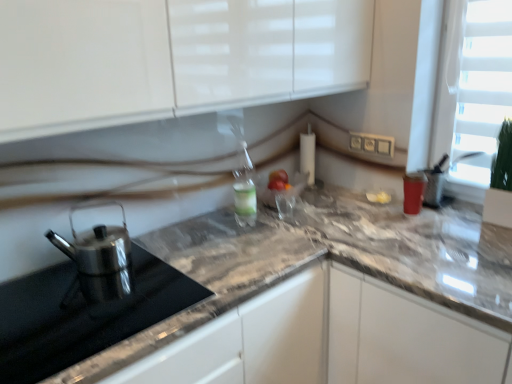
Question: From a real-world perspective, is polished stainless steel kettle at left physically below marble countertop at right?

Choices:
 (A) no
 (B) yes

Answer: (A)

Question: Is the depth of polished stainless steel kettle at left greater than that of marble countertop at right?

Choices:
 (A) no
 (B) yes

Answer: (A)

Question: Is marble countertop at right completely or partially inside polished stainless steel kettle at left?

Choices:
 (A) yes
 (B) no

Answer: (B)

Question: Can you confirm if polished stainless steel kettle at left is wider than marble countertop at right?

Choices:
 (A) yes
 (B) no

Answer: (B)

Question: Is polished stainless steel kettle at left completely or partially outside of marble countertop at right?

Choices:
 (A) yes
 (B) no

Answer: (A)

Question: Does polished stainless steel kettle at left have a greater height compared to marble countertop at right?

Choices:
 (A) no
 (B) yes

Answer: (A)

Question: Is marble countertop at right taller than polished stainless steel kettle at left?

Choices:
 (A) yes
 (B) no

Answer: (A)

Question: Does marble countertop at right turn towards polished stainless steel kettle at left?

Choices:
 (A) no
 (B) yes

Answer: (A)

Question: From the image's perspective, is marble countertop at right over polished stainless steel kettle at left?

Choices:
 (A) yes
 (B) no

Answer: (B)

Question: From the image's perspective, is marble countertop at right under polished stainless steel kettle at left?

Choices:
 (A) no
 (B) yes

Answer: (B)

Question: Does marble countertop at right have a lesser height compared to polished stainless steel kettle at left?

Choices:
 (A) no
 (B) yes

Answer: (A)

Question: Is marble countertop at right outside of polished stainless steel kettle at left?

Choices:
 (A) no
 (B) yes

Answer: (B)

Question: From the image's perspective, would you say polished stainless steel kettle at left is positioned over polished stainless steel kettle at left?

Choices:
 (A) yes
 (B) no

Answer: (A)